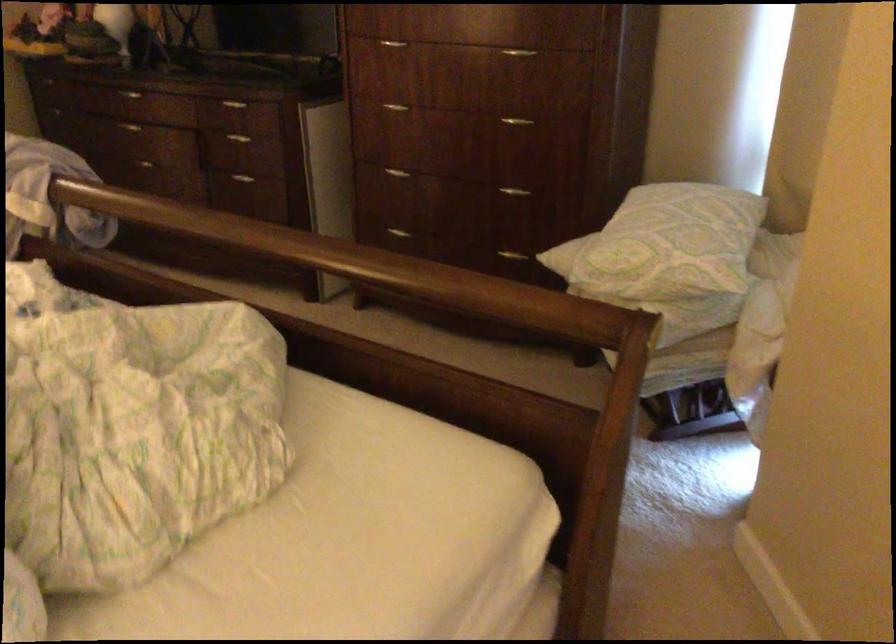
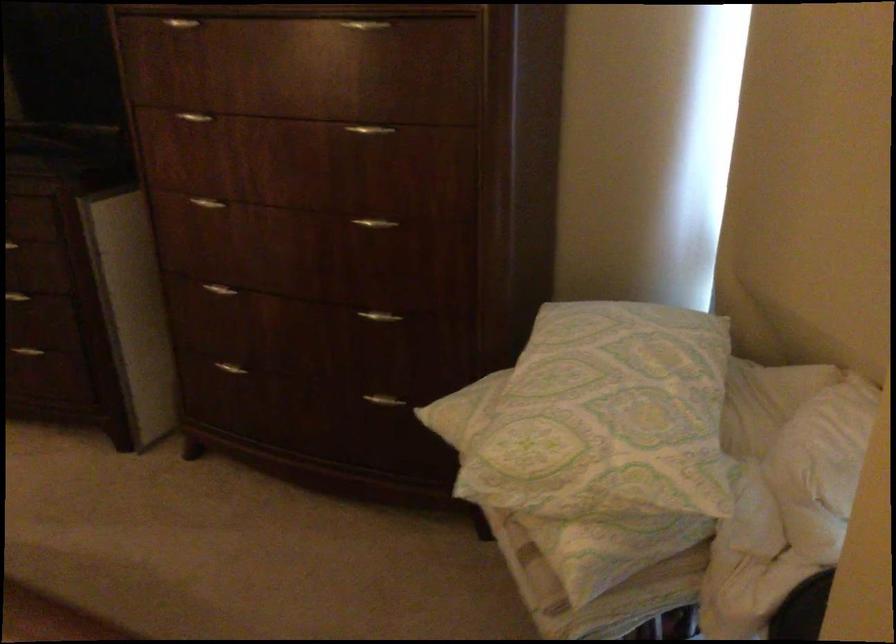
In the second image, find the point that corresponds to the point at 391,106 in the first image.

(207, 203)